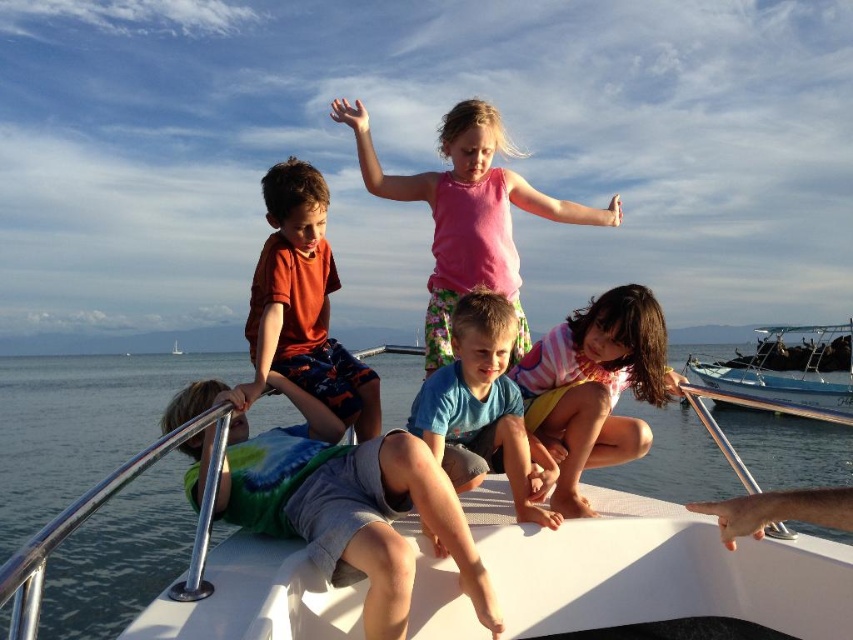
Question: Is matte orange shirt at upper left bigger than white plastic boat at center?

Choices:
 (A) no
 (B) yes

Answer: (B)

Question: Is pink striped shirt at center below white plastic boat at center?

Choices:
 (A) yes
 (B) no

Answer: (B)

Question: Which point is farther from the camera taking this photo?

Choices:
 (A) (22, 428)
 (B) (497, 364)
 (C) (621, 380)

Answer: (A)

Question: Which point appears closest to the camera in this image?

Choices:
 (A) (202, 435)
 (B) (712, 371)
 (C) (550, 371)
 (D) (115, 406)

Answer: (A)

Question: Considering the relative positions of pink fabric dress at center and pink striped shirt at center in the image provided, where is pink fabric dress at center located with respect to pink striped shirt at center?

Choices:
 (A) left
 (B) right

Answer: (A)

Question: Which point is farther to the camera?

Choices:
 (A) (352, 499)
 (B) (175, 340)
 (C) (552, 340)
 (D) (792, 380)

Answer: (B)